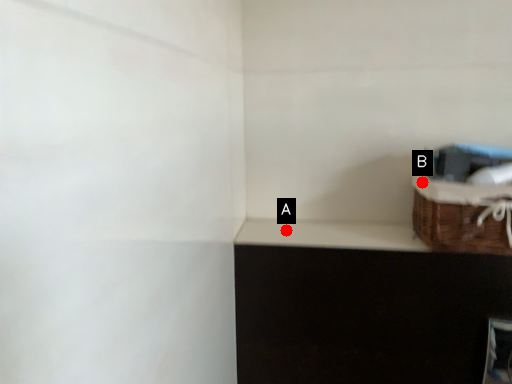
Question: Two points are circled on the image, labeled by A and B beside each circle. Which point is closer to the camera?

Choices:
 (A) A is closer
 (B) B is closer

Answer: (B)